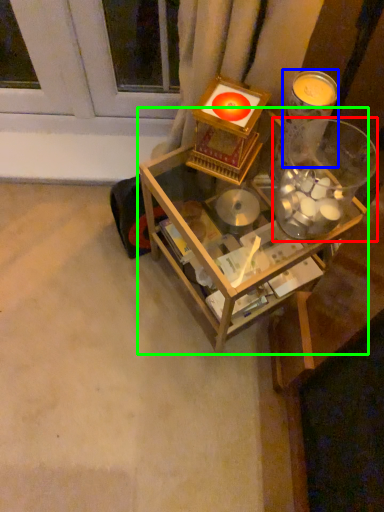
Question: Based on their relative distances, which object is nearer to glass jar (highlighted by a red box)? Choose from candle holder (highlighted by a blue box) and table (highlighted by a green box).

Choices:
 (A) candle holder
 (B) table

Answer: (A)